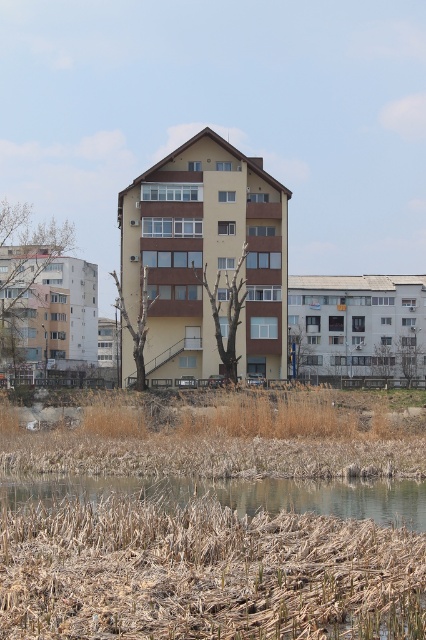
Question: Does brown dry reed at lower left appear on the right side of brown grassy river at lower center?

Choices:
 (A) yes
 (B) no

Answer: (B)

Question: Does brown dry reed at lower left appear on the right side of brown grassy river at lower center?

Choices:
 (A) yes
 (B) no

Answer: (B)

Question: Which point is farther to the camera?

Choices:
 (A) brown grassy river at lower center
 (B) brown dry reed at lower left

Answer: (A)

Question: Which object is closer to the camera taking this photo?

Choices:
 (A) brown dry reed at lower left
 (B) brown grassy river at lower center

Answer: (A)

Question: Is the position of brown dry reed at lower left more distant than that of brown grassy river at lower center?

Choices:
 (A) yes
 (B) no

Answer: (B)